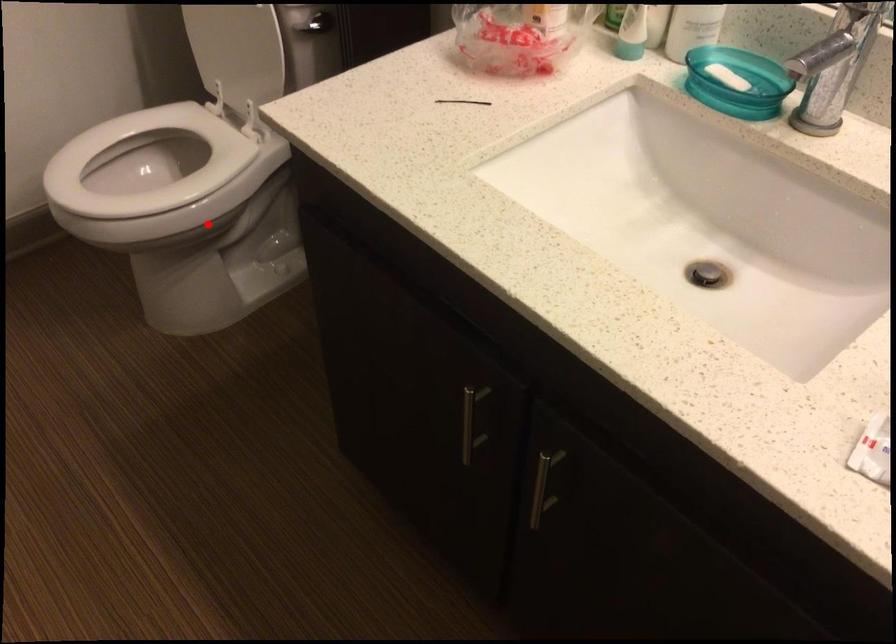
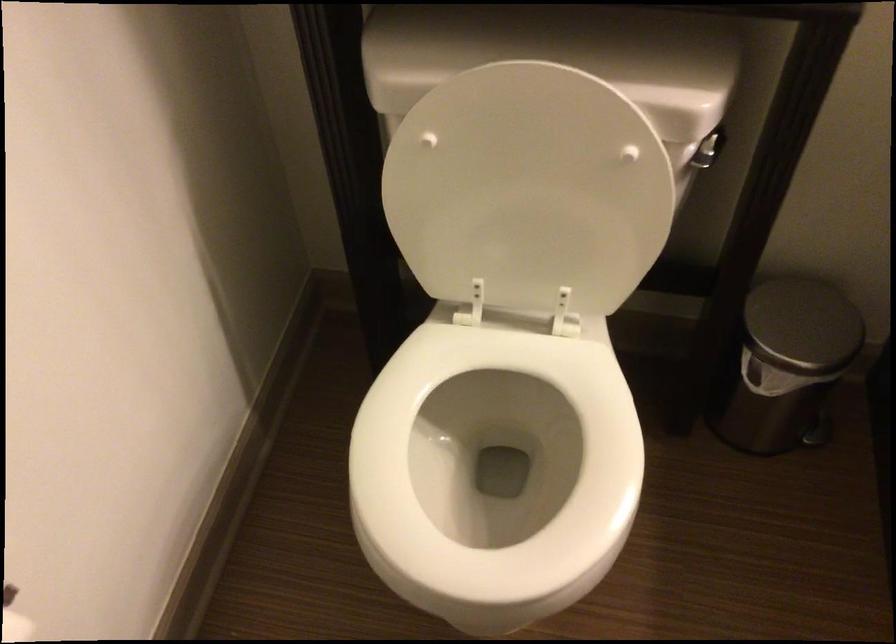
Question: I am providing you with two images of the same scene from different viewpoints. A red point is shown in image1. For the corresponding object point in image2, is it positioned nearer or farther from the camera?

Choices:
 (A) Nearer
 (B) Farther

Answer: (A)